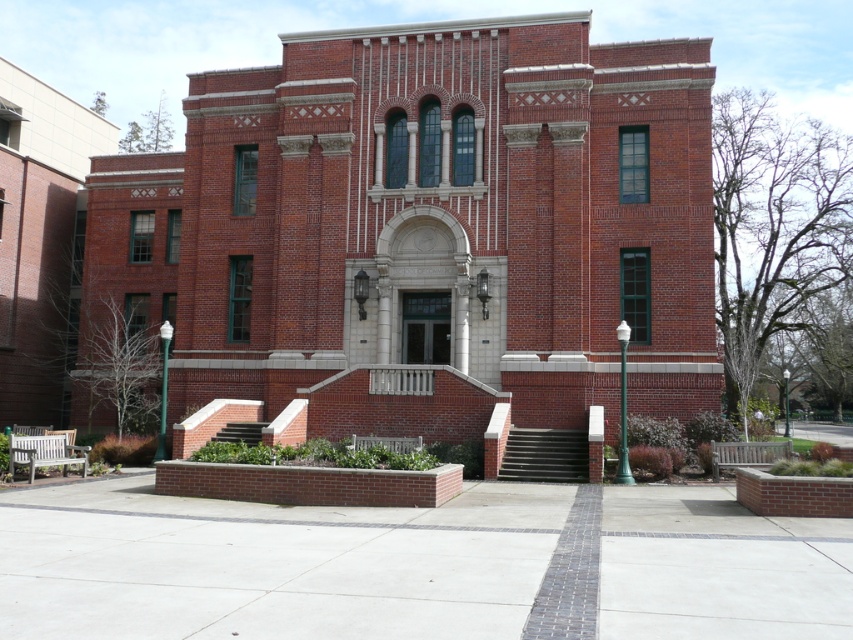
Can you confirm if black concrete stairs at center is positioned above green metal lamp post at center?

Yes.

Which is behind, point (520, 435) or point (619, 426)?

Point (520, 435)

Which is behind, point (540, 436) or point (622, 340)?

Point (540, 436)

This screenshot has width=853, height=640. I want to click on black concrete stairs at center, so click(544, 456).

Is concrete at center thinner than green polished metal lamp post at left?

No, concrete at center is not thinner than green polished metal lamp post at left.

Does concrete at center come behind green polished metal lamp post at left?

No, concrete at center is closer to the viewer.

What do you see at coordinates (271, 563) in the screenshot? Image resolution: width=853 pixels, height=640 pixels. I see `concrete at center` at bounding box center [271, 563].

In order to click on concrete at center in this screenshot , I will do `click(271, 563)`.

Is green metal lamp post at center taller than brown brick stairs at center?

Yes.

Is point (624, 388) less distant than point (247, 428)?

That is True.

This screenshot has height=640, width=853. I want to click on green metal lamp post at center, so click(x=624, y=410).

You are a GUI agent. You are given a task and a screenshot of the screen. Output one action in this format:
    pyautogui.click(x=<x>, y=<y>)
    Task: Click on the green metal lamp post at center
    The height and width of the screenshot is (640, 853).
    Given the screenshot: What is the action you would take?
    pyautogui.click(x=624, y=410)